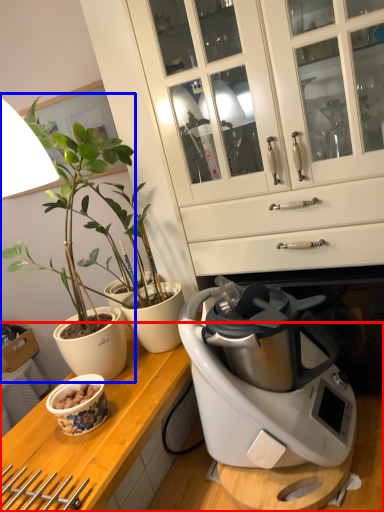
Question: Which object appears closest to the camera in this image, countertop (highlighted by a red box) or houseplant (highlighted by a blue box)?

Choices:
 (A) countertop
 (B) houseplant

Answer: (A)